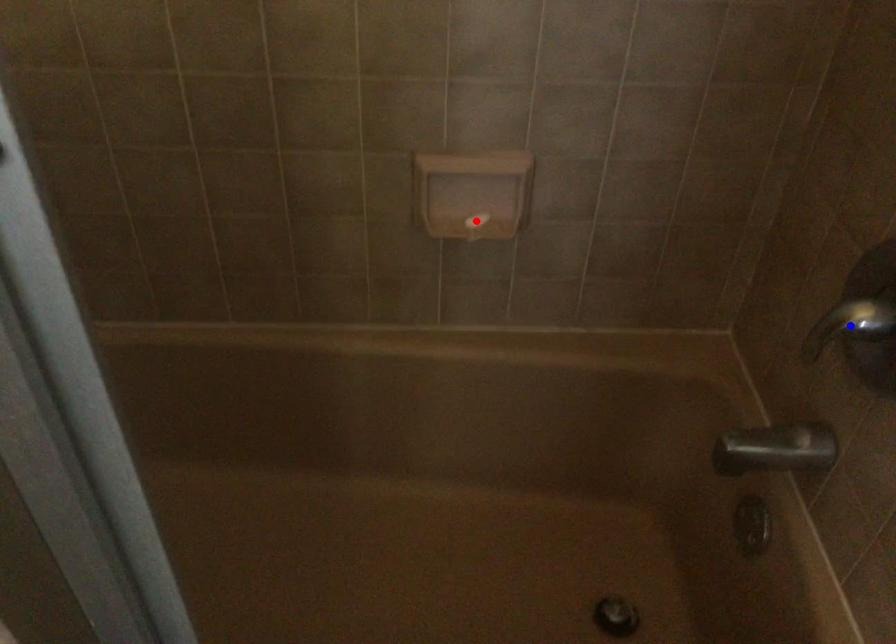
Question: Which of the two points in the image is closer to the camera?

Choices:
 (A) Blue point is closer.
 (B) Red point is closer.

Answer: (A)